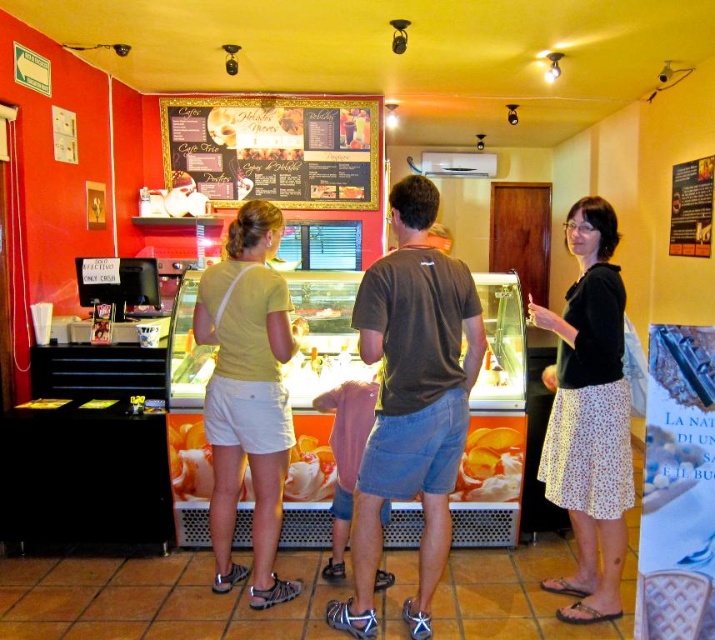
Question: Does brown cotton t-shirt at center appear over black cotton skirt at center?

Choices:
 (A) no
 (B) yes

Answer: (A)

Question: Does light beige shorts at center have a larger size compared to wooden menu board at upper center?

Choices:
 (A) no
 (B) yes

Answer: (B)

Question: Which is farther from the light beige shorts at center?

Choices:
 (A) black cotton skirt at center
 (B) brown cotton t-shirt at center

Answer: (A)

Question: Which point is closer to the camera?

Choices:
 (A) light beige shorts at center
 (B) wooden menu board at upper center
 (C) black cotton skirt at center
 (D) brown cotton t-shirt at center

Answer: (D)

Question: Observing the image, what is the correct spatial positioning of brown cotton t-shirt at center in reference to wooden menu board at upper center?

Choices:
 (A) below
 (B) above

Answer: (A)

Question: Considering the real-world distances, which object is farthest from the brown cotton t-shirt at center?

Choices:
 (A) light beige shorts at center
 (B) black cotton skirt at center

Answer: (B)